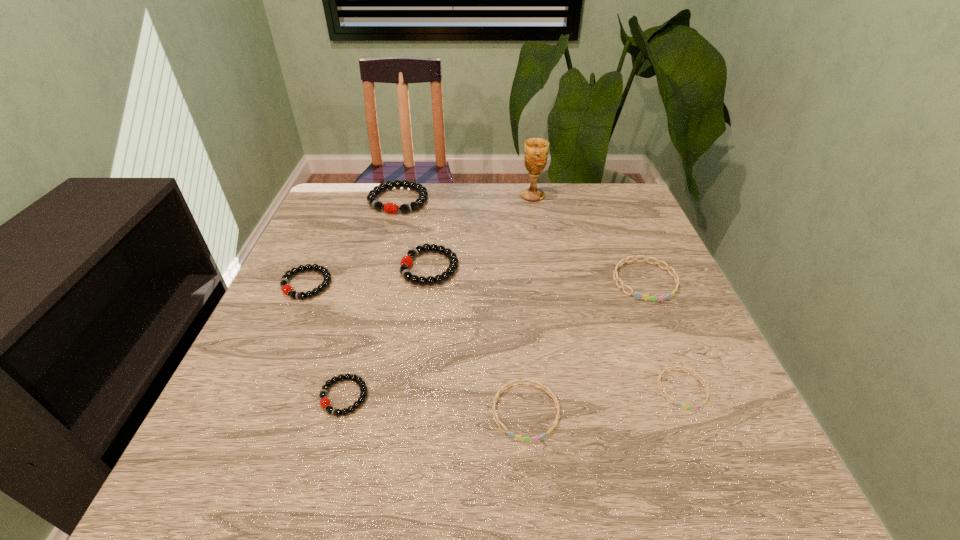
This screenshot has width=960, height=540. Find the location of `chalice`. chalice is located at coordinates coord(536,150).

Locate an element on the screen. The image size is (960, 540). the farthest black bracelet is located at coordinates (392, 208).

The width and height of the screenshot is (960, 540). In order to click on the tallest bracelet in this screenshot , I will do `click(392, 208)`.

I want to click on the second biggest black bracelet, so click(406, 262).

Identify the location of the farthest blue bracelet. (652, 298).

Find the location of `the leftmost object`. the leftmost object is located at coordinates (286, 289).

What are the coordinates of `the leftmost black bracelet` in the screenshot? It's located at (286, 289).

I want to click on the fifth bracelet from left to right, so click(x=519, y=437).

I want to click on the second smallest blue bracelet, so click(519, 437).

Where is `the smallest black bracelet`? The width and height of the screenshot is (960, 540). the smallest black bracelet is located at coordinates (325, 403).